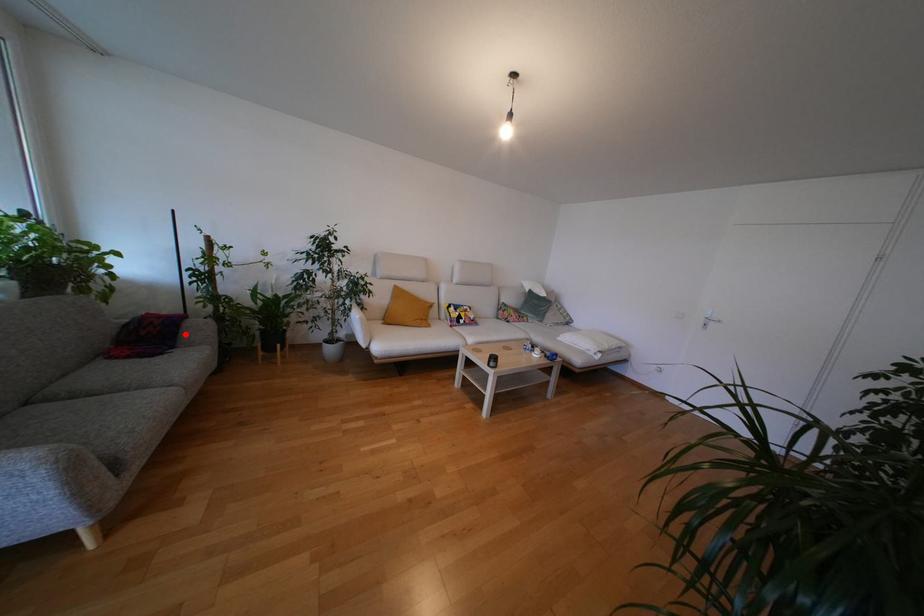
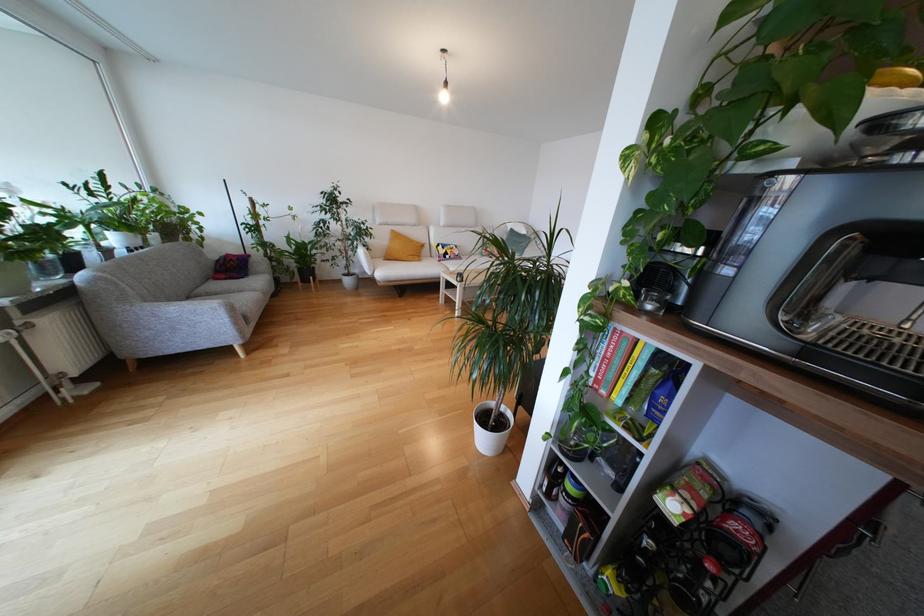
Question: I am providing you with two images of the same scene from different viewpoints. Given a red point in image1, look at the same physical point in image2. Is it:

Choices:
 (A) Closer to the viewpoint
 (B) Farther from the viewpoint

Answer: (A)